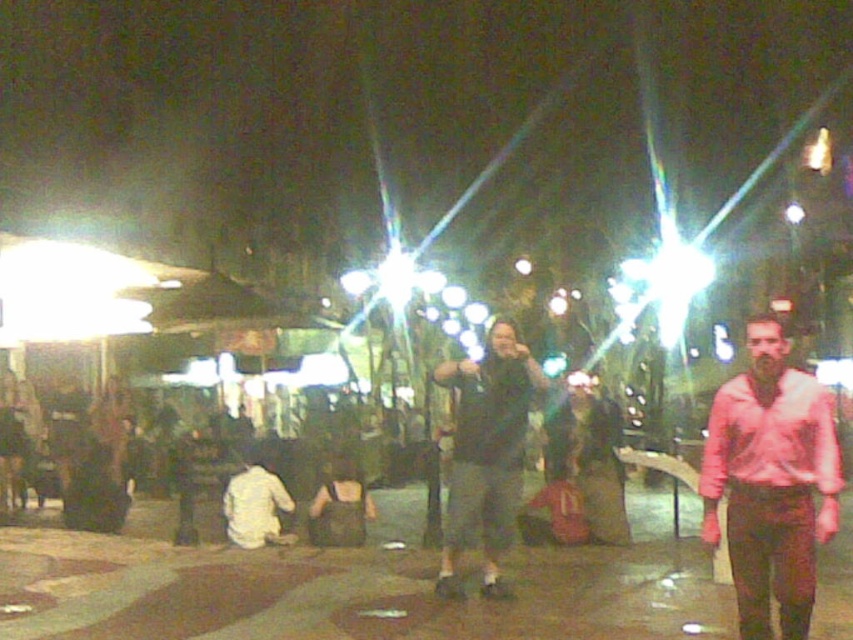
Question: Does pink cotton shirt at right appear on the right side of dark gray fabric jacket at center?

Choices:
 (A) no
 (B) yes

Answer: (B)

Question: Can you confirm if pink cotton shirt at right is positioned to the right of dark gray fabric jacket at center?

Choices:
 (A) yes
 (B) no

Answer: (A)

Question: Can you confirm if pink cotton shirt at right is positioned below dark gray fabric jacket at center?

Choices:
 (A) yes
 (B) no

Answer: (B)

Question: Which point is closer to the camera?

Choices:
 (A) pink cotton shirt at right
 (B) dark gray fabric jacket at center

Answer: (A)

Question: Which of the following is the farthest from the observer?

Choices:
 (A) dark gray fabric jacket at center
 (B) pink cotton shirt at right

Answer: (A)